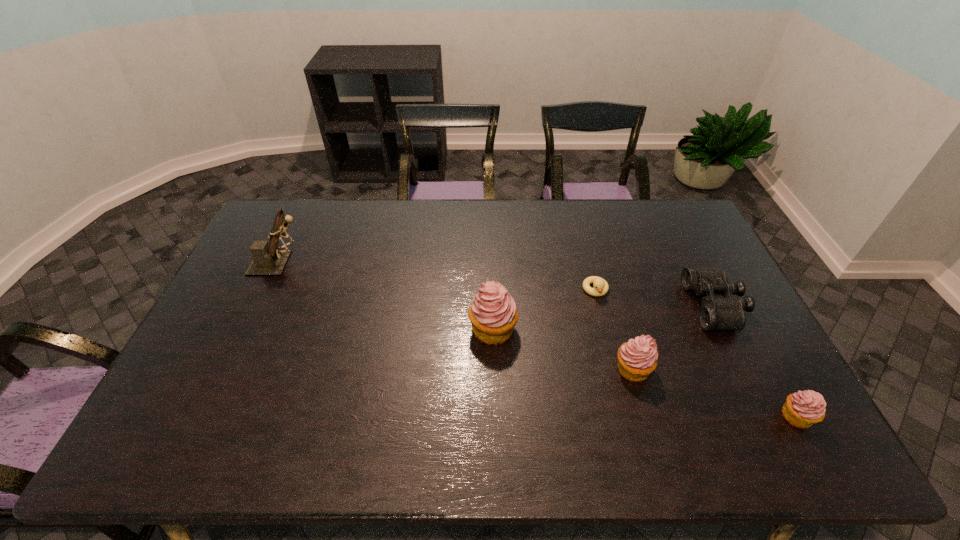
Where is `free point that satisfies the following two spatial constraints: 1. on the front side of the second tallest cupcake; 2. on the left side of the shortest cupcake`? Image resolution: width=960 pixels, height=540 pixels. free point that satisfies the following two spatial constraints: 1. on the front side of the second tallest cupcake; 2. on the left side of the shortest cupcake is located at coordinates (646, 416).

Where is `vacant area in the image that satisfies the following two spatial constraints: 1. at the eyepieces of the binoculars; 2. on the back side of the nearest object`? This screenshot has width=960, height=540. vacant area in the image that satisfies the following two spatial constraints: 1. at the eyepieces of the binoculars; 2. on the back side of the nearest object is located at coordinates (770, 416).

Image resolution: width=960 pixels, height=540 pixels. Find the location of `vacant space that satisfies the following two spatial constraints: 1. at the beak of the fourth shortest object; 2. on the right side of the duckling`. vacant space that satisfies the following two spatial constraints: 1. at the beak of the fourth shortest object; 2. on the right side of the duckling is located at coordinates (615, 369).

Find the location of `blank space that satisfies the following two spatial constraints: 1. on the front side of the second tallest cupcake; 2. on the left side of the fifth object from right to left`. blank space that satisfies the following two spatial constraints: 1. on the front side of the second tallest cupcake; 2. on the left side of the fifth object from right to left is located at coordinates (494, 369).

At what (x,y) coordinates should I click in order to perform the action: click on free region that satisfies the following two spatial constraints: 1. at the eyepieces of the binoculars; 2. on the right side of the nearest cupcake. Please return your answer as a coordinate pair (x, y). The width and height of the screenshot is (960, 540). Looking at the image, I should click on (770, 416).

I want to click on blank area in the image that satisfies the following two spatial constraints: 1. on the front side of the second cupcake from right to left; 2. on the right side of the rightmost cupcake, so click(646, 416).